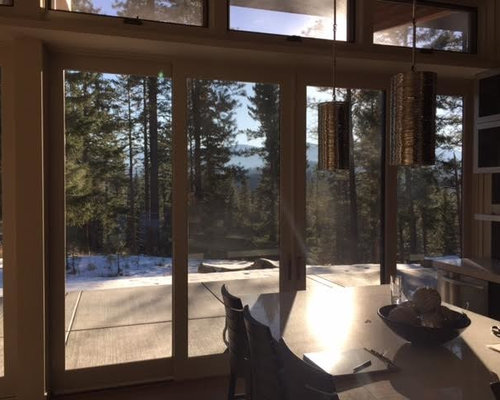
Identify the location of light fixture. (333, 136), (424, 125).